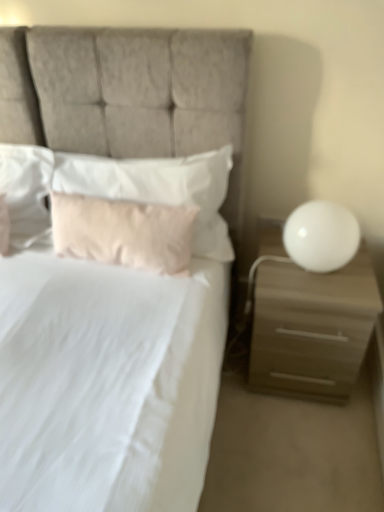
Where is `unoccupied area in front of white glossy sphere at right`? The width and height of the screenshot is (384, 512). unoccupied area in front of white glossy sphere at right is located at coordinates (327, 292).